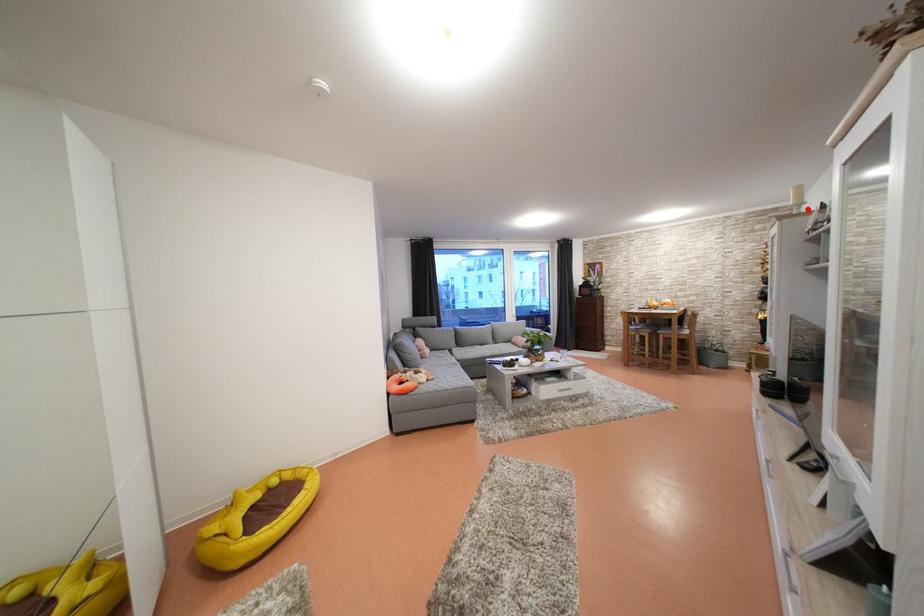
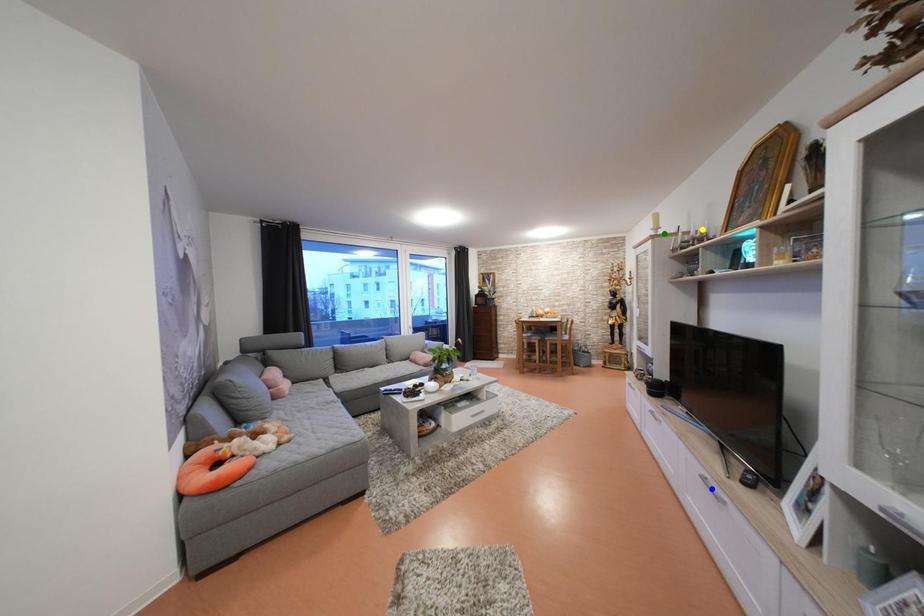
Question: I am providing you with two images of the same scene from different viewpoints. A red point is marked on the first image. You are given multiple points on the second image. Can you choose the point in image 2 that corresponds to the point in image 1?

Choices:
 (A) blue point
 (B) green point
 (C) yellow point

Answer: (B)